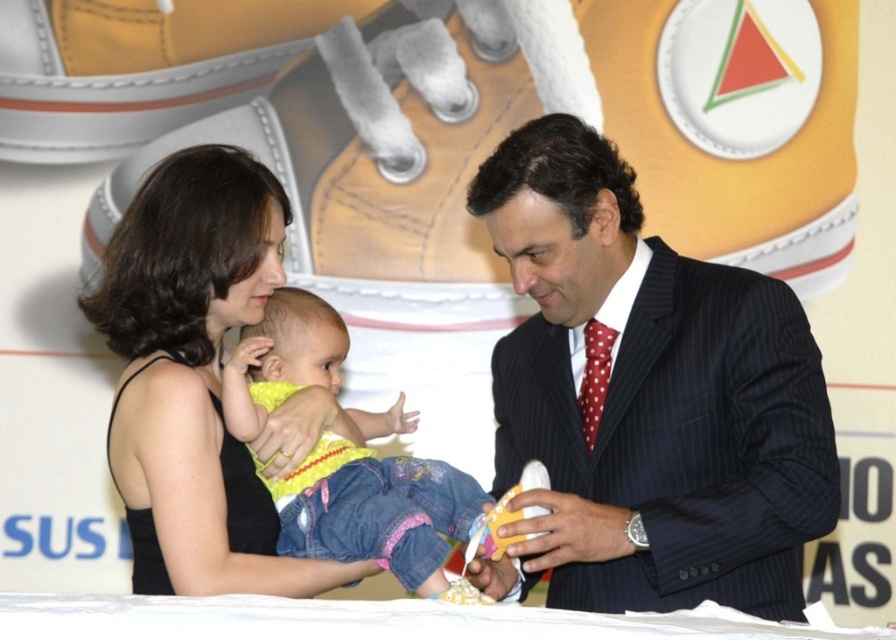
Is point (777, 444) positioned before point (266, 280)?

Yes, point (777, 444) is closer to viewer.

Does dark pinstripe suit at center appear on the left side of black fabric dress at center?

In fact, dark pinstripe suit at center is to the right of black fabric dress at center.

Is point (575, 326) farther from camera compared to point (266, 506)?

Yes, it is.

The width and height of the screenshot is (896, 640). I want to click on dark pinstripe suit at center, so click(x=648, y=396).

I want to click on black fabric dress at center, so click(x=195, y=378).

Which of these two, black fabric dress at center or yellow denim pants at center, stands taller?

black fabric dress at center is taller.

Is point (252, 204) less distant than point (411, 492)?

Yes.

This screenshot has width=896, height=640. I want to click on black fabric dress at center, so [195, 378].

Is dark pinstripe suit at center to the right of yellow denim pants at center from the viewer's perspective?

Yes, dark pinstripe suit at center is to the right of yellow denim pants at center.

Can you confirm if dark pinstripe suit at center is wider than yellow denim pants at center?

Yes, dark pinstripe suit at center is wider than yellow denim pants at center.

Between point (707, 422) and point (307, 513), which one is positioned in front?

Point (707, 422) is more forward.

You are a GUI agent. You are given a task and a screenshot of the screen. Output one action in this format:
    pyautogui.click(x=<x>, y=<y>)
    Task: Click on the dark pinstripe suit at center
    This screenshot has height=640, width=896.
    Given the screenshot: What is the action you would take?
    pyautogui.click(x=648, y=396)